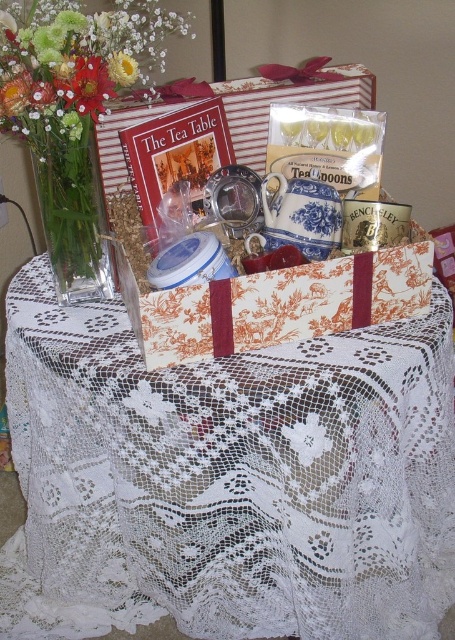
Question: Does clear glass vase at left appear over red matte flower at upper left?

Choices:
 (A) no
 (B) yes

Answer: (A)

Question: Which point is closer to the camera taking this photo?

Choices:
 (A) click(86, 132)
 (B) click(16, 80)
 (C) click(183, 400)

Answer: (B)

Question: Which object is farther from the camera taking this photo?

Choices:
 (A) yellow fabric flower at upper left
 (B) red matte flower at upper left
 (C) clear glass vase at left
 (D) white lace tablecloth at center

Answer: (C)

Question: From the image, what is the correct spatial relationship of white lace tablecloth at center in relation to yellow fabric flower at upper left?

Choices:
 (A) below
 (B) above

Answer: (A)

Question: Can you confirm if clear glass vase at left is smaller than red matte flower at upper left?

Choices:
 (A) no
 (B) yes

Answer: (A)

Question: Considering the real-world distances, which object is farthest from the yellow fabric flower at upper left?

Choices:
 (A) matte floral bouquet at upper left
 (B) white lace tablecloth at center
 (C) clear glass vase at left
 (D) red matte flower at upper left

Answer: (B)